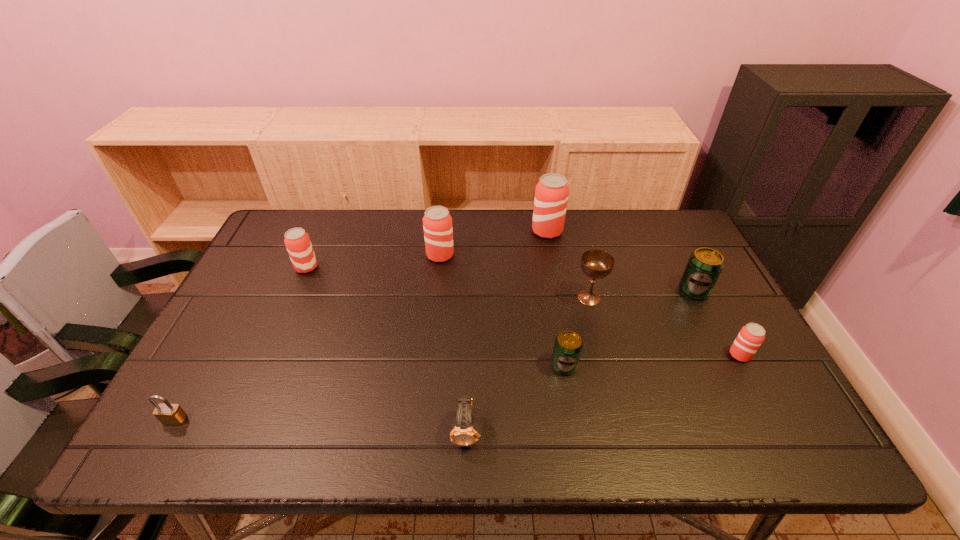
Image resolution: width=960 pixels, height=540 pixels. Find the location of `the farthest beer can`. the farthest beer can is located at coordinates (551, 193).

Where is `the tallest beer can`? The height and width of the screenshot is (540, 960). the tallest beer can is located at coordinates (551, 193).

Locate an element on the screen. The height and width of the screenshot is (540, 960). the second beer can from left to right is located at coordinates (437, 222).

You are a GUI agent. You are given a task and a screenshot of the screen. Output one action in this format:
    pyautogui.click(x=<x>, y=<y>)
    Task: Click on the fifth shortest beer can
    
    Given the screenshot: What is the action you would take?
    pyautogui.click(x=437, y=222)

Find the location of `chalice`. chalice is located at coordinates (597, 264).

Image resolution: width=960 pixels, height=540 pixels. Identify the location of the second object from left to right. (297, 241).

At what (x,y) coordinates should I click in order to perform the action: click on the leftmost beer can. Please return your answer as a coordinate pair (x, y). Image resolution: width=960 pixels, height=540 pixels. Looking at the image, I should click on (297, 241).

The image size is (960, 540). I want to click on the bigger green beer can, so click(704, 266).

The height and width of the screenshot is (540, 960). In order to click on the farther green beer can in this screenshot , I will do `click(704, 266)`.

Find the location of a particular element. the left green beer can is located at coordinates (568, 345).